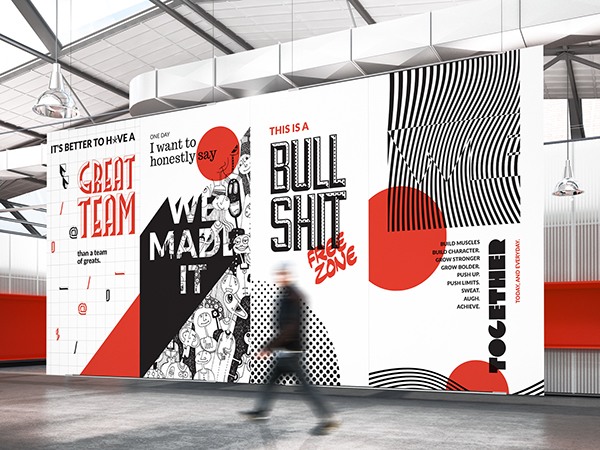
Identify the location of white vertically lined wall. The width and height of the screenshot is (600, 450). (584, 232), (28, 254).